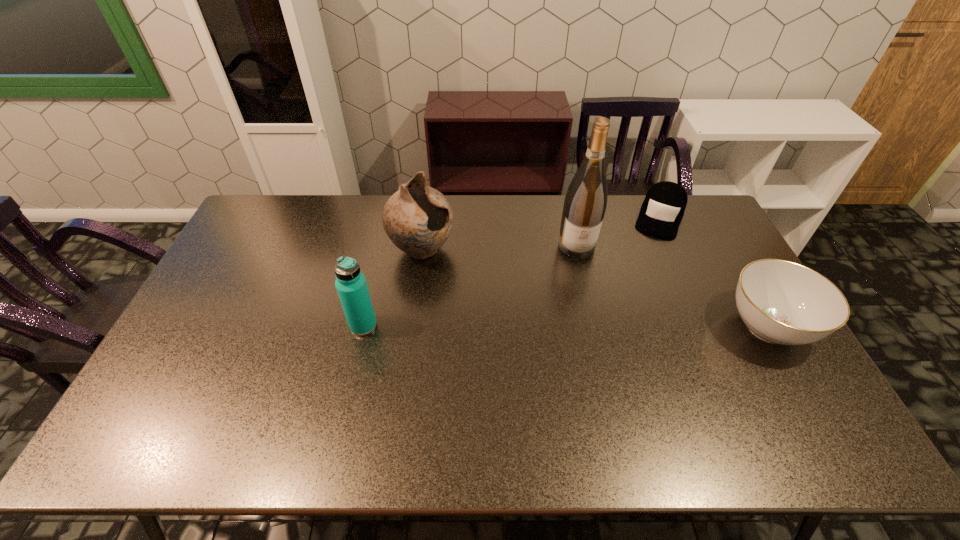
Where is `chinaware that is at the right edge`? The width and height of the screenshot is (960, 540). chinaware that is at the right edge is located at coordinates (782, 302).

In order to click on cap located in the right edge section of the desktop in this screenshot , I will do `click(662, 210)`.

This screenshot has width=960, height=540. Find the location of `object positioned at the far right corner`. object positioned at the far right corner is located at coordinates (662, 210).

In the image, there is a desktop. Identify the location of free space at the far edge. (478, 221).

Image resolution: width=960 pixels, height=540 pixels. In order to click on free space at the near edge in this screenshot , I will do `click(636, 401)`.

Locate an element on the screen. This screenshot has width=960, height=540. vacant space at the left edge of the desktop is located at coordinates (263, 252).

Locate an element on the screen. free space at the right edge of the desktop is located at coordinates (701, 266).

This screenshot has width=960, height=540. In order to click on free spot at the near left corner of the desktop in this screenshot , I will do `click(183, 399)`.

I want to click on vacant region at the far right corner of the desktop, so click(692, 214).

Identify the location of free area in between the fourth tallest object and the pottery. (595, 288).